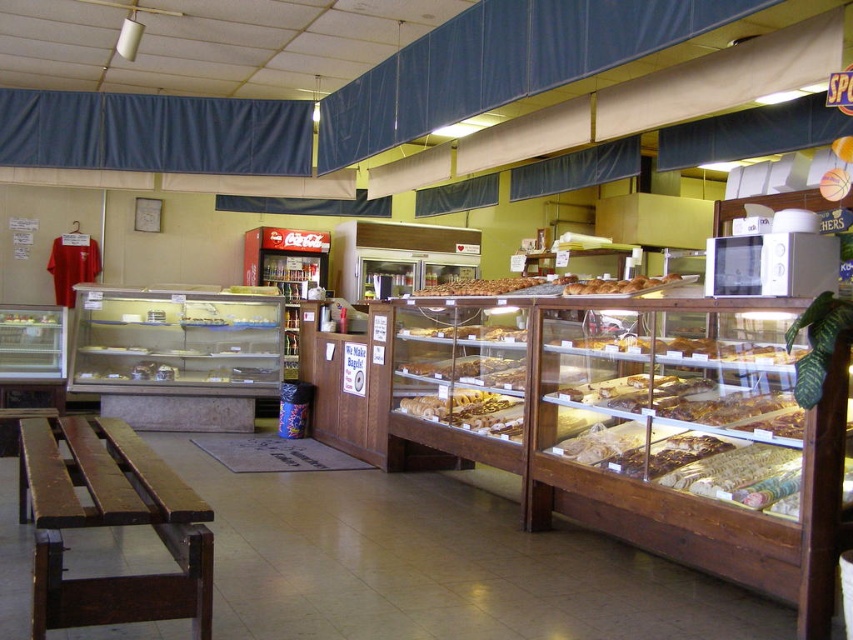
You are a customer standing in the bakery and want to reach the brown matte bread at center. The bakery has a rule that customers must stay at least 6 feet away from each other. If another customer is standing 10 feet away from you, can you safely approach the bread without violating the rule?

The brown matte bread at center is 17.93 feet away from you. Since another customer is 10 feet away, you can approach the bread as long as you maintain at least 6 feet between yourself and the other customer. The total distance to the bread allows for this, so it is safe to proceed.

You are a baker who needs to place both the brown matte bread at center and the golden brown bread at center on a shelf that can only hold items up to 12 inches in width. Given their widths, can both fit side by side without overlapping?

The brown matte bread at center is wider than the golden brown bread at center. Since the shelf can only hold items up to 12 inches, we need to know their exact widths. However, the description only states that the brown matte bread is larger in width. Without specific measurements, we cannot confirm if their combined widths exceed 12 inches. More information is needed.

You are a customer in the bakery and want to reach the brown matte bread at center. The display case has a glass panel at point 0.5, 0.5. Can you reach the bread without moving the glass panel?

The brown matte bread at center is located at point (479,285), which is slightly to the left and above the glass panel at point (426,320). Therefore, you can reach the bread without moving the glass panel.